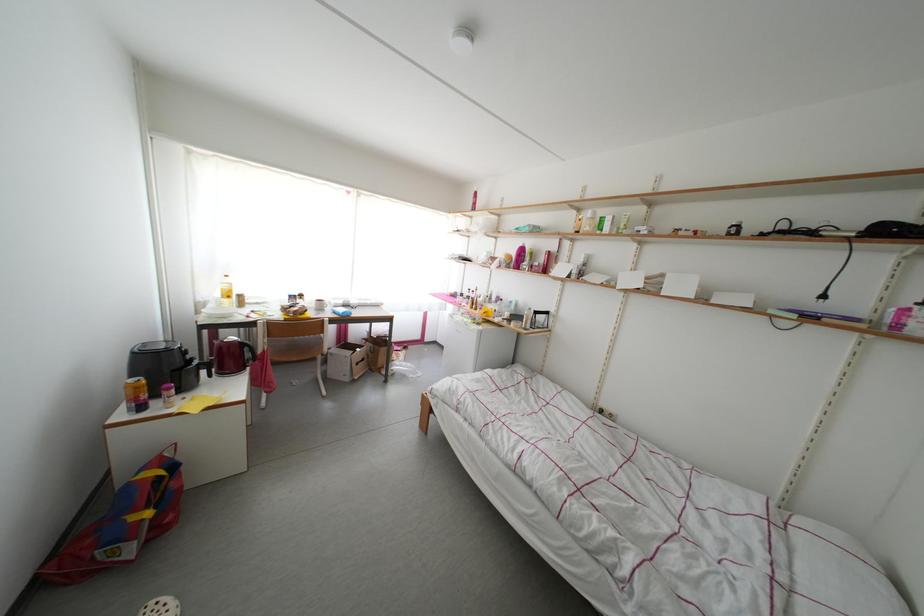
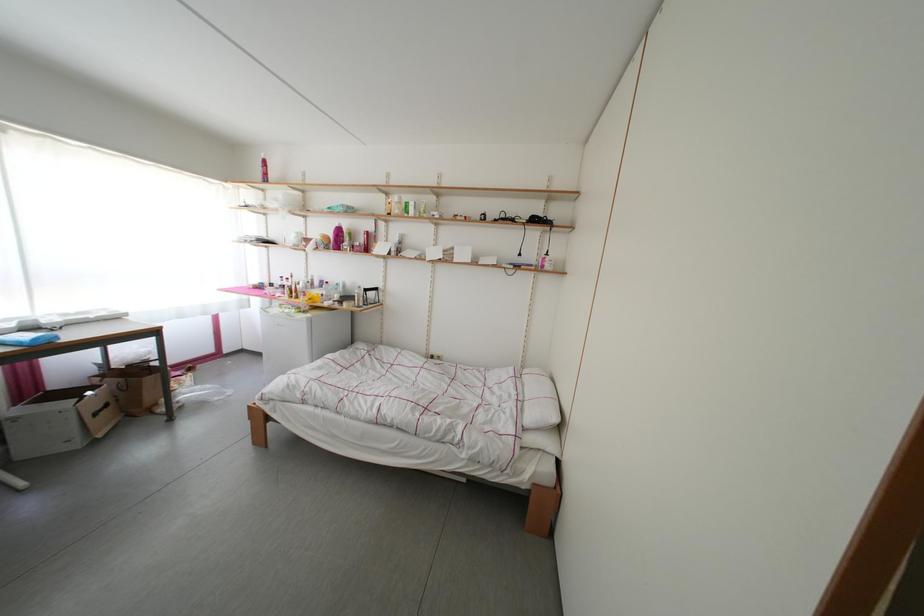
Question: The camera is either moving clockwise (left) or counter-clockwise (right) around the object. The first image is from the beginning of the video and the second image is from the end. Is the camera moving left or right when shooting the video?

Choices:
 (A) Left
 (B) Right

Answer: (A)